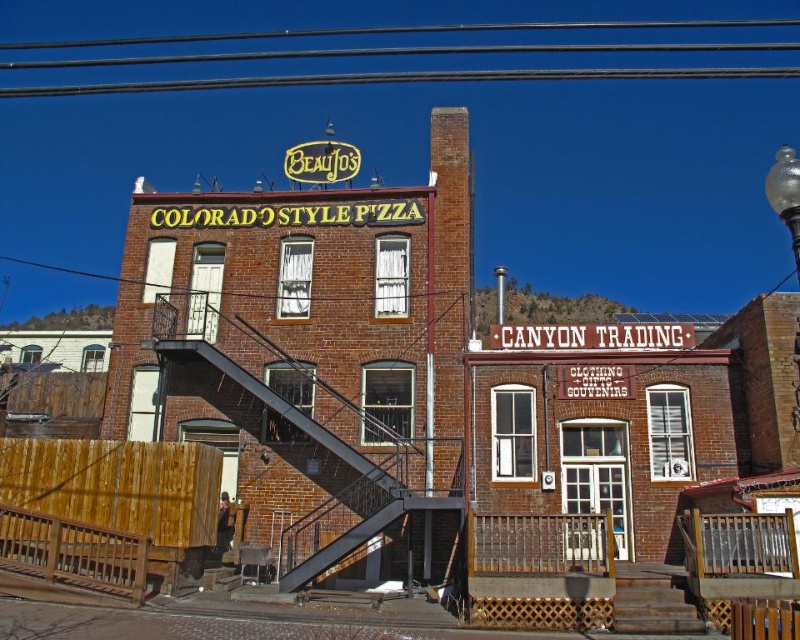
Question: Which point is farther to the camera?

Choices:
 (A) (345, 448)
 (B) (768, 195)

Answer: (B)

Question: Which point is closer to the camera?

Choices:
 (A) (454, 500)
 (B) (794, 244)

Answer: (A)

Question: Is metallic black staircase at center positioned before transparent glass globe at upper right?

Choices:
 (A) no
 (B) yes

Answer: (A)

Question: Is metallic black staircase at center positioned before transparent glass globe at upper right?

Choices:
 (A) yes
 (B) no

Answer: (B)

Question: Is metallic black staircase at center above transparent glass globe at upper right?

Choices:
 (A) no
 (B) yes

Answer: (A)